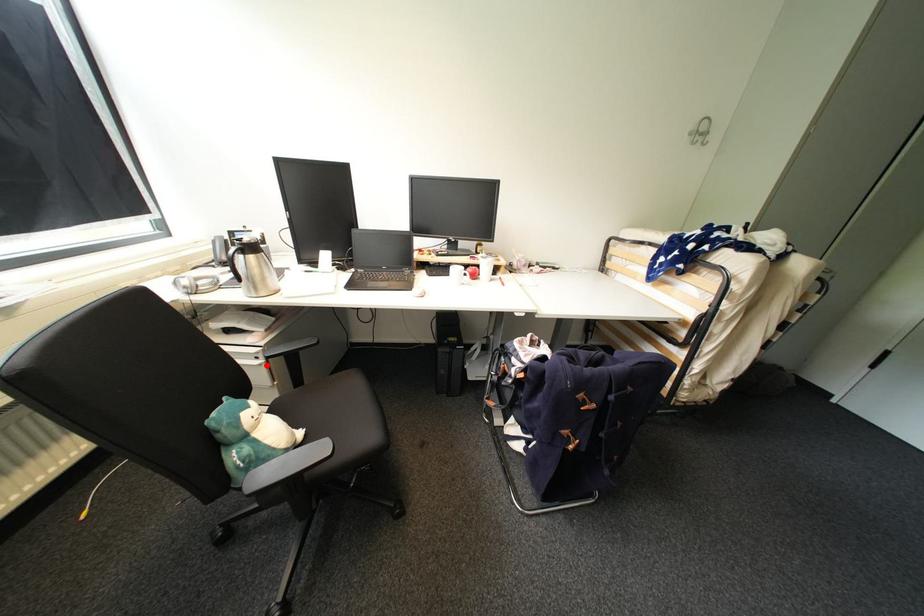
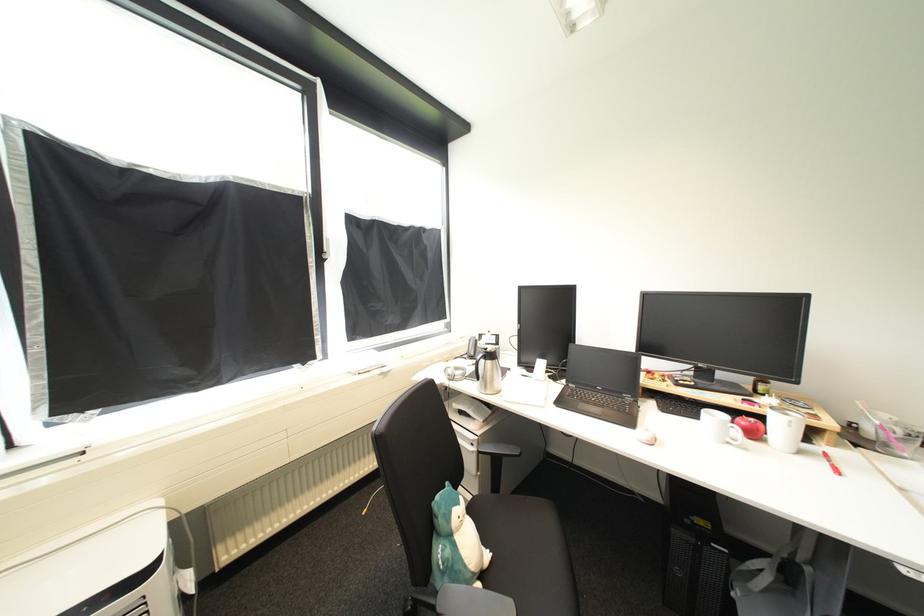
Where in the second image is the point corresponding to the highlighted location from the first image?

(480, 453)